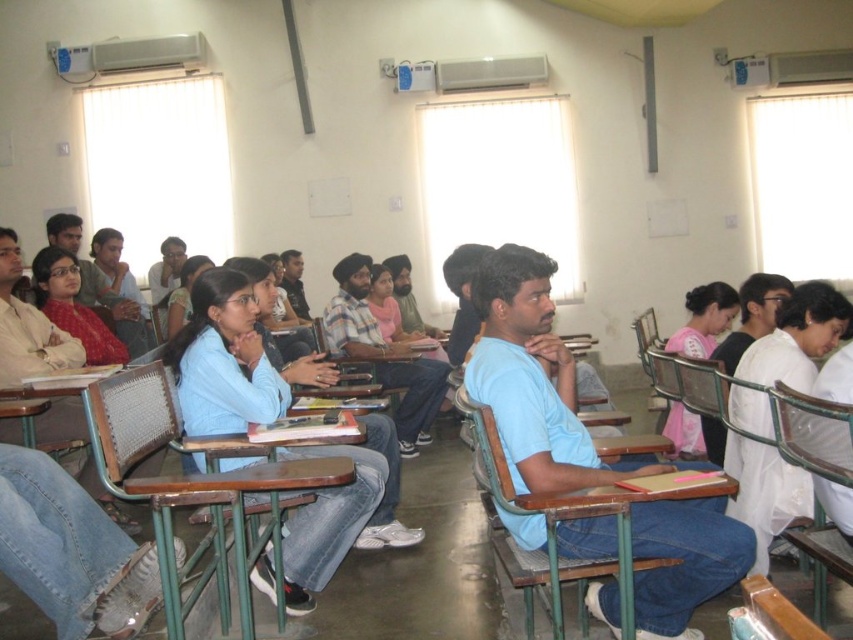
From the picture: Where is the wooden at center located in the image?

The wooden at center is located at point (x=233, y=518).

You are organizing a classroom activity and need to place a 10cm wide object on the wooden at center and the matte blue shirt at center. Which object can accommodate the 10cm wide object without overlapping?

The matte blue shirt at center can accommodate the 10cm wide object since it has a greater width than the wooden at center, which is narrower.